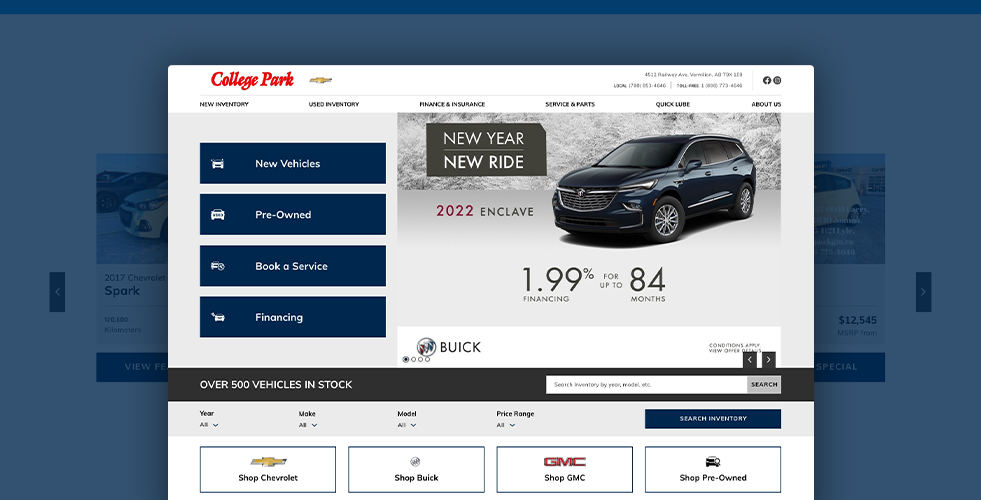
In order to click on window in this screenshot , I will do `click(716, 147)`.